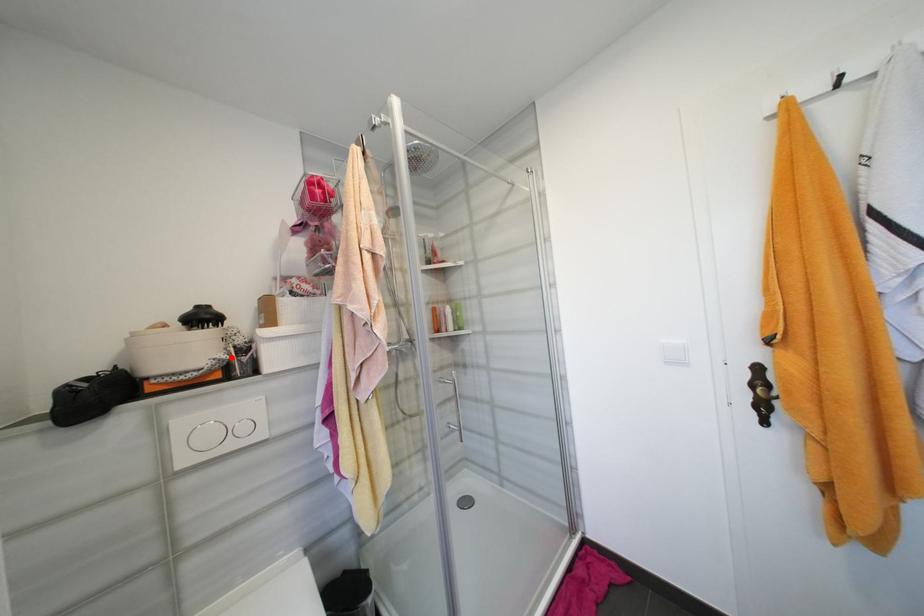
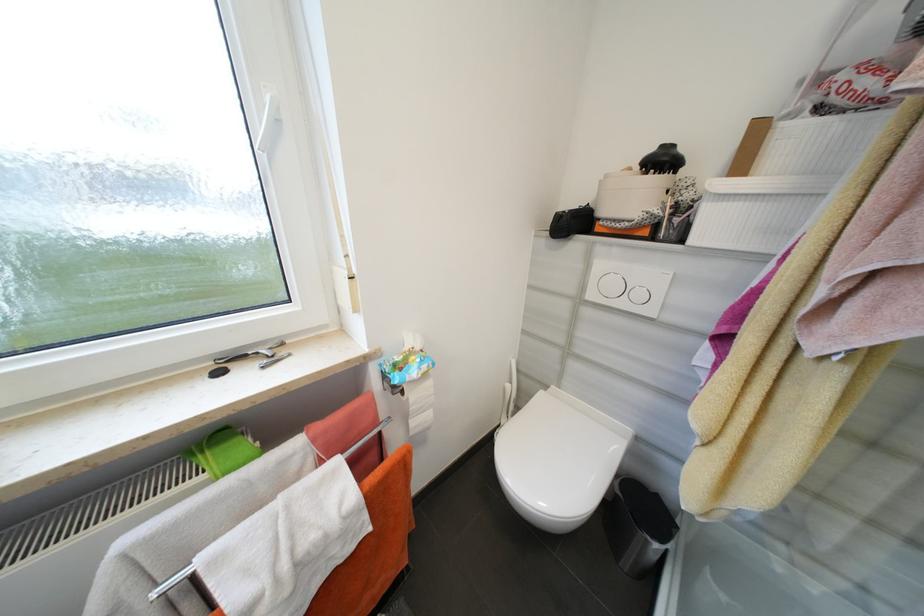
Find the pixel in the second image that matches the highlighted location in the first image.

(663, 213)